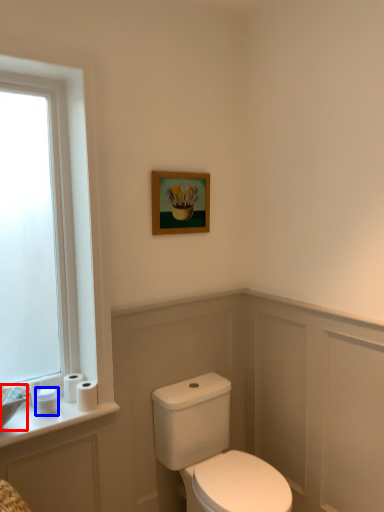
Question: Which point is closer to the camera, sink (highlighted by a red box) or toilet paper (highlighted by a blue box)?

Choices:
 (A) sink
 (B) toilet paper

Answer: (A)